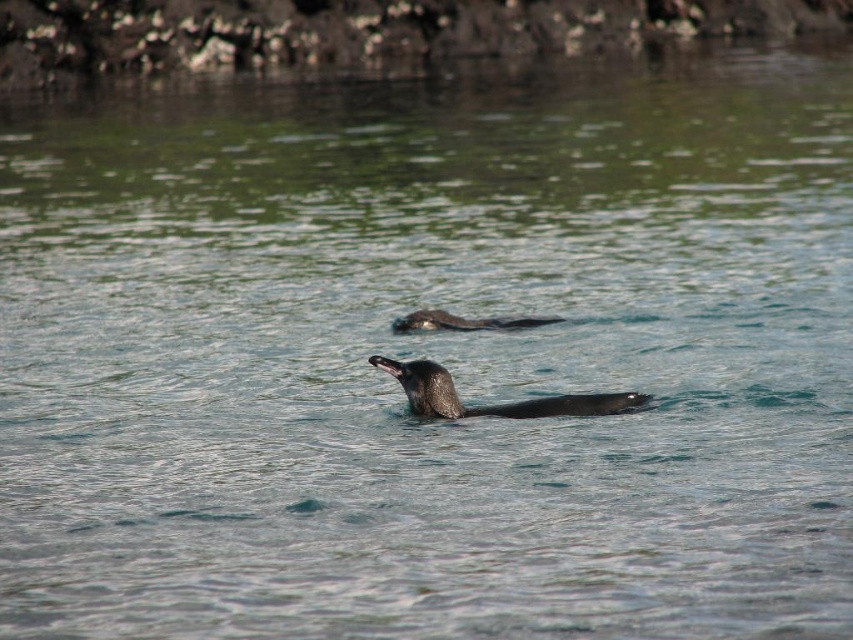
Question: Is shiny black otter at center to the right of black matte otter at center from the viewer's perspective?

Choices:
 (A) yes
 (B) no

Answer: (A)

Question: Which of the following is the farthest from the observer?

Choices:
 (A) (413, 323)
 (B) (401, 376)

Answer: (A)

Question: Which point is closer to the camera?

Choices:
 (A) shiny black otter at center
 (B) black matte otter at center

Answer: (A)

Question: Where is shiny black otter at center located in relation to black matte otter at center in the image?

Choices:
 (A) below
 (B) above

Answer: (A)

Question: Is shiny black otter at center closer to camera compared to black matte otter at center?

Choices:
 (A) yes
 (B) no

Answer: (A)